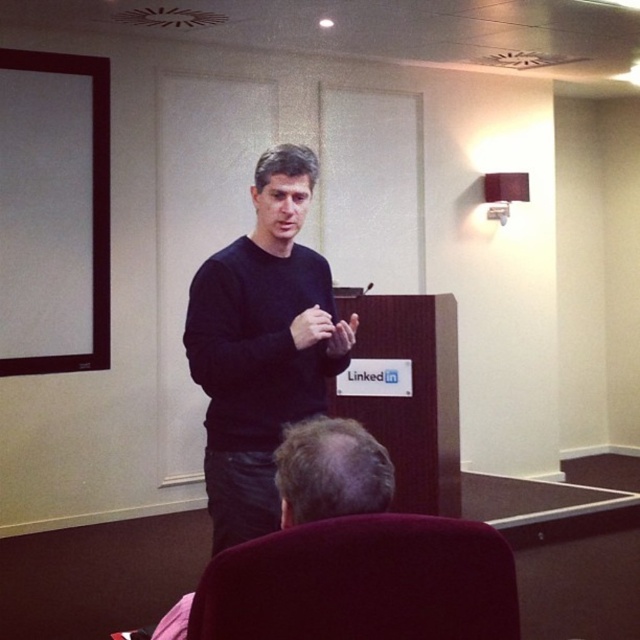
Question: Is black matte sweater at center wider than velvet maroon chair at lower center?

Choices:
 (A) yes
 (B) no

Answer: (A)

Question: Does black matte sweater at center lie behind velvet maroon chair at lower center?

Choices:
 (A) no
 (B) yes

Answer: (B)

Question: Does black matte sweater at center have a greater width compared to velvet maroon chair at lower center?

Choices:
 (A) yes
 (B) no

Answer: (A)

Question: Among these objects, which one is farthest from the camera?

Choices:
 (A) velvet maroon chair at lower center
 (B) black matte sweater at center

Answer: (B)